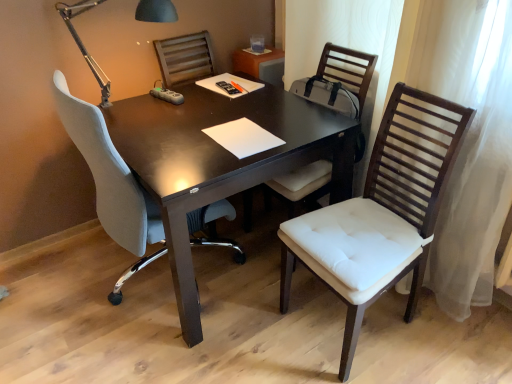
This screenshot has width=512, height=384. In order to click on empty space that is to the right of white paper at center in this screenshot , I will do `click(307, 124)`.